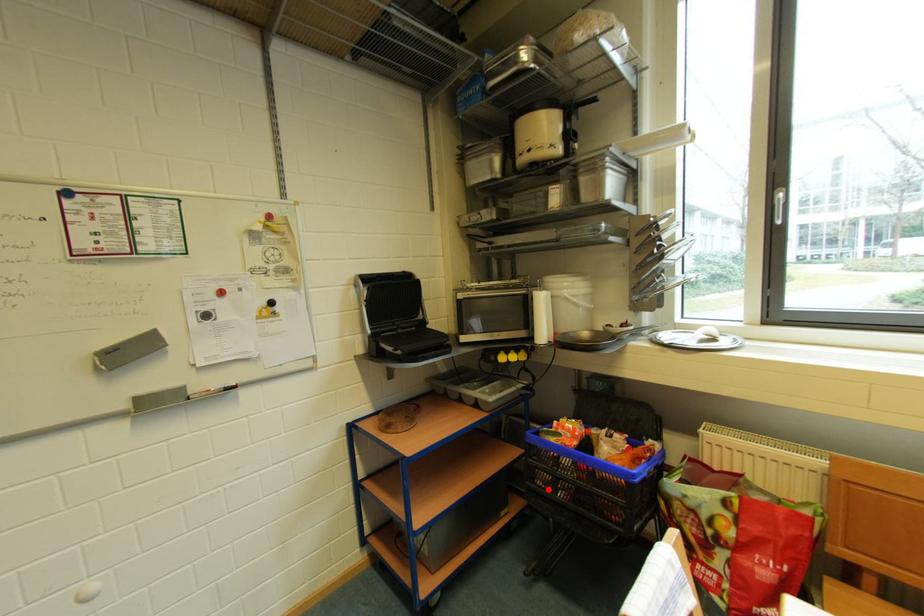
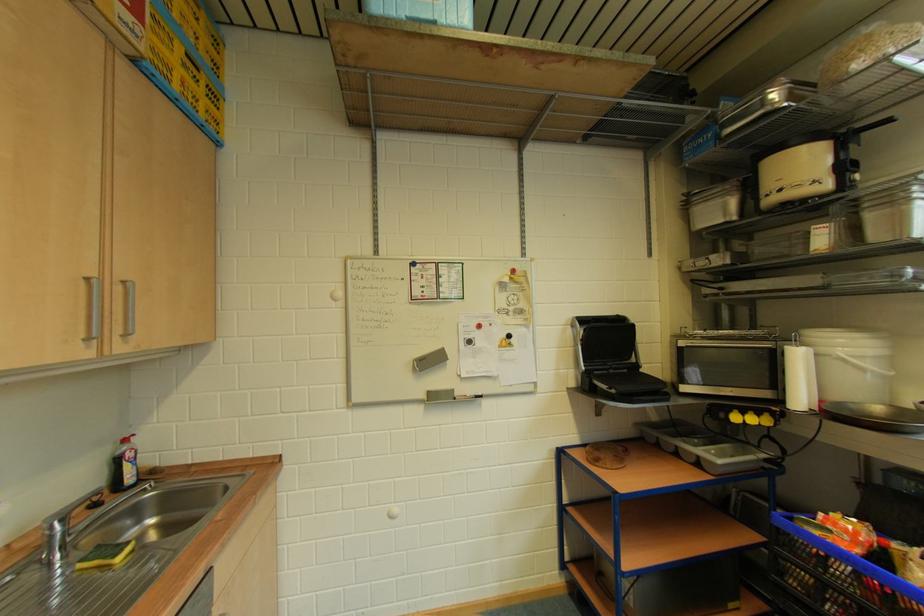
Question: I am providing you with two images of the same scene from different viewpoints. A red point is marked on the first image. At the location where the point appears in image 1, is it still visible in image 2?

Choices:
 (A) Yes
 (B) No

Answer: (A)